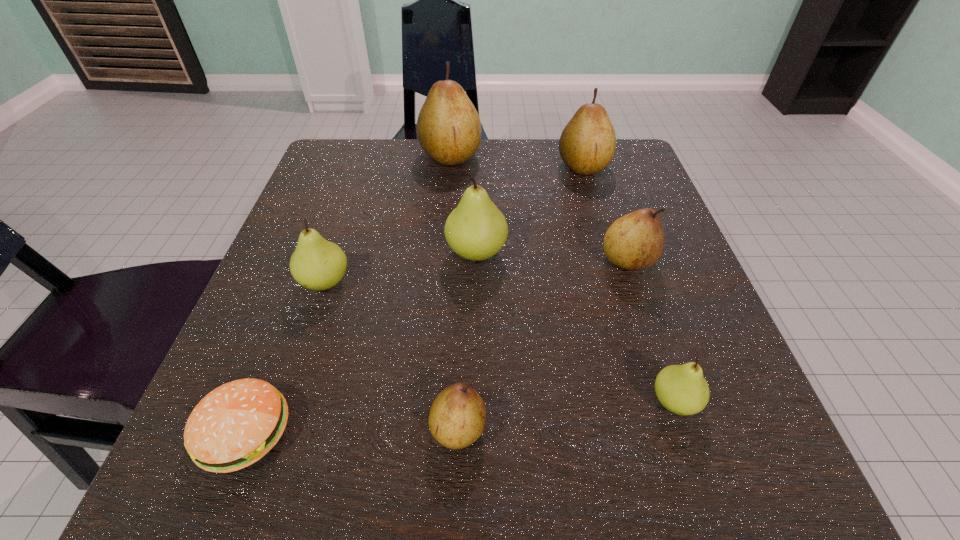
Locate an element on the screen. free space at the far left corner of the desktop is located at coordinates tap(342, 175).

Where is `blank space at the far right corner of the desktop`? This screenshot has height=540, width=960. blank space at the far right corner of the desktop is located at coordinates (583, 194).

The image size is (960, 540). Identify the location of vacant region between the second smallest brown pear and the second biggest brown pear. (606, 214).

This screenshot has height=540, width=960. I want to click on vacant space that is in between the tallest pear and the nearest brown pear, so click(x=454, y=292).

Find the location of a particular element. The image size is (960, 540). vacant space that's between the nearest green pear and the nearest brown pear is located at coordinates (566, 415).

The width and height of the screenshot is (960, 540). What are the coordinates of `free spot between the shortest object and the leftmost pear` in the screenshot? It's located at (285, 357).

Identify the location of vacant space that is in between the smallest brown pear and the second smallest brown pear. The image size is (960, 540). click(x=542, y=345).

This screenshot has width=960, height=540. I want to click on unoccupied position between the third farthest brown pear and the smallest green pear, so click(651, 331).

This screenshot has height=540, width=960. Find the location of `free space between the leftmost green pear and the biggest green pear`. free space between the leftmost green pear and the biggest green pear is located at coordinates (400, 267).

Identify the location of vacant space in between the biggest green pear and the smallest green pear. This screenshot has height=540, width=960. (575, 327).